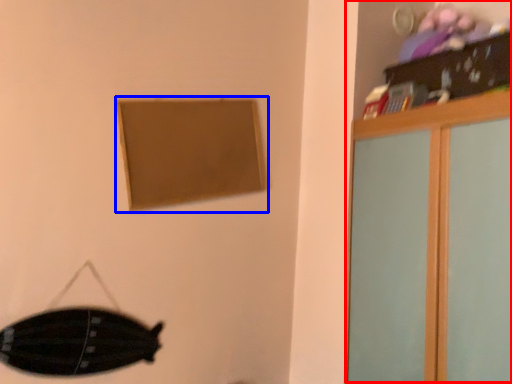
Question: Which point is further to the camera, dresser (highlighted by a red box) or picture frame (highlighted by a blue box)?

Choices:
 (A) dresser
 (B) picture frame

Answer: (B)